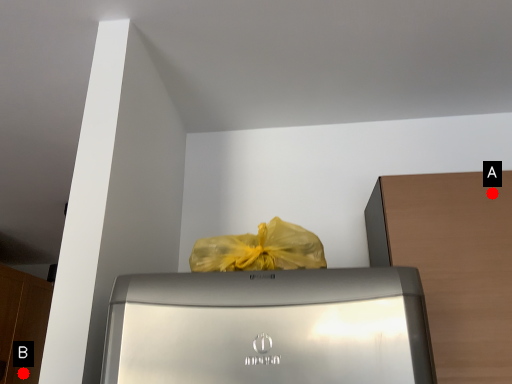
Question: Two points are circled on the image, labeled by A and B beside each circle. Which point is further to the camera?

Choices:
 (A) A is further
 (B) B is further

Answer: (B)